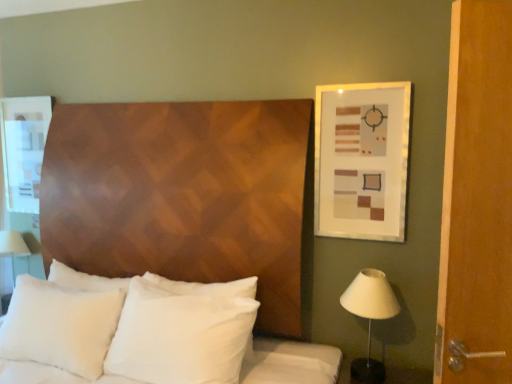
Locate an element on the screen. matte white picture frame at upper right is located at coordinates (362, 160).

What is the approximate width of white matte lampshade at right?

white matte lampshade at right is 10.85 inches in width.

What do you see at coordinates (370, 317) in the screenshot?
I see `white matte lampshade at right` at bounding box center [370, 317].

Identify the location of white soft pillow at center, acting as the 2th pillow starting from the left. This screenshot has width=512, height=384. (183, 331).

What do you see at coordinates (146, 334) in the screenshot?
I see `white soft pillows at center` at bounding box center [146, 334].

Find the location of `matte white picture frame at upper right`. matte white picture frame at upper right is located at coordinates (362, 160).

Could you tell me if white fabric table lamp at left is turned towards white soft pillow at center, the first pillow viewed from the right?

No, white fabric table lamp at left is not facing towards white soft pillow at center, the first pillow viewed from the right.

From the image's perspective, which one is positioned higher, white fabric table lamp at left or white soft pillow at center, acting as the 2th pillow starting from the left?

white fabric table lamp at left, from the image's perspective.

Measure the distance from white fabric table lamp at left to white soft pillow at center, acting as the 2th pillow starting from the left.

A distance of 1.49 meters exists between white fabric table lamp at left and white soft pillow at center, acting as the 2th pillow starting from the left.

Is white fabric table lamp at left thinner than white soft pillow at center, acting as the 2th pillow starting from the left?

Incorrect, the width of white fabric table lamp at left is not less than that of white soft pillow at center, acting as the 2th pillow starting from the left.

Could you tell me if white soft pillow at center, acting as the 2th pillow starting from the left, is facing white soft pillow at center, which is the 2th pillow from right to left?

No.

Does white soft pillow at center, acting as the 2th pillow starting from the left, come in front of white soft pillow at center, which is the 2th pillow from right to left?

No, white soft pillow at center, acting as the 2th pillow starting from the left, is behind white soft pillow at center, which is the 2th pillow from right to left.

Considering the sizes of white soft pillow at center, the first pillow viewed from the right, and white soft pillow at center, which is the 2th pillow from right to left, in the image, is white soft pillow at center, the first pillow viewed from the right, bigger or smaller than white soft pillow at center, which is the 2th pillow from right to left,?

white soft pillow at center, the first pillow viewed from the right, is smaller than white soft pillow at center, which is the 2th pillow from right to left.

Would you say white soft pillow at center, acting as the 2th pillow starting from the left, is outside white soft pillow at center, which is the 2th pillow from right to left?

Yes, white soft pillow at center, acting as the 2th pillow starting from the left, is outside of white soft pillow at center, which is the 2th pillow from right to left.

Can you tell me how much white matte lampshade at right and matte white picture frame at upper right differ in facing direction?

white matte lampshade at right and matte white picture frame at upper right are facing 0.448 degrees away from each other.

Find the location of a particular element. bedside lamp below the matte white picture frame at upper right (from a real-world perspective) is located at coordinates pos(370,317).

Are white matte lampshade at right and matte white picture frame at upper right making contact?

No, white matte lampshade at right is not touching matte white picture frame at upper right.

Which is nearer, (379, 305) or (341, 196)?

Point (379, 305) is closer to the camera than point (341, 196).

From the image's perspective, is white soft pillows at center located beneath matte white picture frame at upper right?

Indeed, from the image's perspective, white soft pillows at center is shown beneath matte white picture frame at upper right.

Based on the photo, would you say white soft pillows at center is outside matte white picture frame at upper right?

white soft pillows at center lies outside matte white picture frame at upper right's area.

Which object is positioned more to the left, white soft pillows at center or matte white picture frame at upper right?

white soft pillows at center is more to the left.

In the scene shown: In the image, is white soft pillows at center positioned in front of or behind matte white picture frame at upper right?

Visually, white soft pillows at center is located in front of matte white picture frame at upper right.

From a real-world perspective, is white soft pillows at center on top of white soft pillow at center, acting as the 2th pillow starting from the left?

No.

Measure the distance between white soft pillows at center and white soft pillow at center, the first pillow viewed from the right.

white soft pillows at center and white soft pillow at center, the first pillow viewed from the right, are 3.21 inches apart.

Considering the positions of objects white soft pillows at center and white soft pillow at center, acting as the 2th pillow starting from the left, in the image provided, who is more to the left, white soft pillows at center or white soft pillow at center, acting as the 2th pillow starting from the left,?

From the viewer's perspective, white soft pillows at center appears more on the left side.

From the image's perspective, is white soft pillows at center positioned above or below white soft pillow at center, the first pillow viewed from the right?

From the image's perspective, white soft pillows at center appears below white soft pillow at center, the first pillow viewed from the right.

At what (x,y) coordinates should I click in order to perform the action: click on pillow that is the 2nd one when counting leftward from the matte white picture frame at upper right. Please return your answer as a coordinate pair (x, y). Looking at the image, I should click on (60, 326).

From a real-world perspective, is matte white picture frame at upper right above or below white soft pillow at center, acting as the 1th pillow starting from the left?

matte white picture frame at upper right is situated higher than white soft pillow at center, acting as the 1th pillow starting from the left, in the real world.

Does point (351, 197) come closer to viewer compared to point (36, 325)?

No, (351, 197) is behind (36, 325).

At what (x,y) coordinates should I click in order to perform the action: click on table lamp located behind the matte white picture frame at upper right. Please return your answer as a coordinate pair (x, y). Looking at the image, I should click on (12, 246).

Considering the positions of objects matte white picture frame at upper right and white fabric table lamp at left in the image provided, who is in front, matte white picture frame at upper right or white fabric table lamp at left?

matte white picture frame at upper right is closer to the camera.

This screenshot has width=512, height=384. I want to click on pillow that is the 2nd one when counting rightward from the white fabric table lamp at left, so click(183, 331).

The image size is (512, 384). Identify the location of pillow that is behind the white soft pillow at center, acting as the 1th pillow starting from the left. (183, 331).

When comparing their distances from matte white picture frame at upper right, does white matte lampshade at right or white soft pillow at center, which is the 2th pillow from right to left, seem further?

Among the two, white soft pillow at center, which is the 2th pillow from right to left, is located further to matte white picture frame at upper right.

Based on their spatial positions, is white soft pillow at center, acting as the 1th pillow starting from the left, or white soft pillow at center, acting as the 2th pillow starting from the left, further from white soft pillows at center?

white soft pillow at center, acting as the 1th pillow starting from the left, is positioned further to the anchor white soft pillows at center.

Considering their positions, is matte white picture frame at upper right positioned further to white soft pillow at center, which is the 2th pillow from right to left, than white soft pillows at center?

matte white picture frame at upper right.

From the image, which object appears to be farther from white fabric table lamp at left, matte white picture frame at upper right or white soft pillow at center, which is the 2th pillow from right to left?

matte white picture frame at upper right lies further to white fabric table lamp at left than the other object.

From the image, which object appears to be nearer to white soft pillow at center, the first pillow viewed from the right, white soft pillow at center, which is the 2th pillow from right to left, or white soft pillows at center?

Based on the image, white soft pillows at center appears to be nearer to white soft pillow at center, the first pillow viewed from the right.

When comparing their distances from white fabric table lamp at left, does white soft pillow at center, which is the 2th pillow from right to left, or white soft pillow at center, the first pillow viewed from the right, seem further?

white soft pillow at center, the first pillow viewed from the right, is positioned further to the anchor white fabric table lamp at left.

From the image, which object appears to be farther from white fabric table lamp at left, white soft pillow at center, acting as the 2th pillow starting from the left, or matte white picture frame at upper right?

The object further to white fabric table lamp at left is matte white picture frame at upper right.

Based on the photo, considering their positions, is white soft pillows at center positioned further to white matte lampshade at right than white soft pillow at center, the first pillow viewed from the right?

white soft pillows at center is further to white matte lampshade at right.

The height and width of the screenshot is (384, 512). Identify the location of pillow situated between white soft pillows at center and white matte lampshade at right from left to right. (183, 331).

This screenshot has height=384, width=512. In order to click on picture frame located between white soft pillow at center, the first pillow viewed from the right, and white matte lampshade at right in the left-right direction in this screenshot , I will do `click(362, 160)`.

You are a GUI agent. You are given a task and a screenshot of the screen. Output one action in this format:
    pyautogui.click(x=<x>, y=<y>)
    Task: Click on the bed between white soft pillow at center, which is the 2th pillow from right to left, and matte white picture frame at upper right
    
    Given the screenshot: What is the action you would take?
    pyautogui.click(x=146, y=334)

The image size is (512, 384). In order to click on bed between white fabric table lamp at left and white matte lampshade at right in the horizontal direction in this screenshot , I will do `click(146, 334)`.